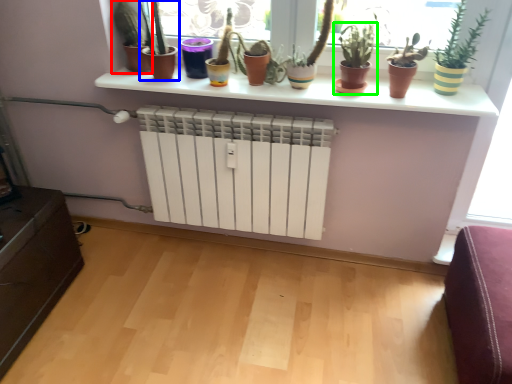
Question: Based on their relative distances, which object is nearer to houseplant (highlighted by a red box)? Choose from houseplant (highlighted by a blue box) and houseplant (highlighted by a green box).

Choices:
 (A) houseplant
 (B) houseplant

Answer: (A)